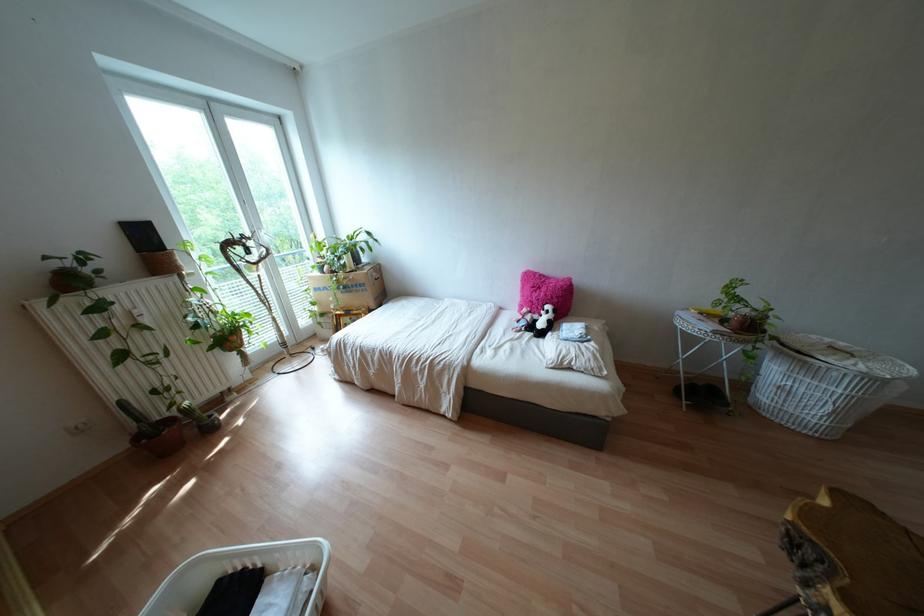
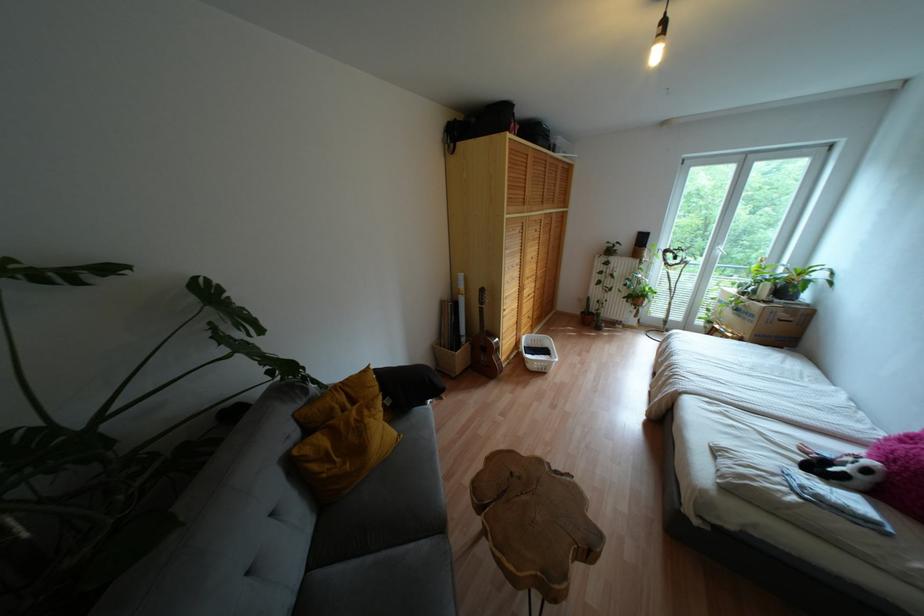
Find the pixel in the second image that matches point 349,291 in the first image.

(737, 315)